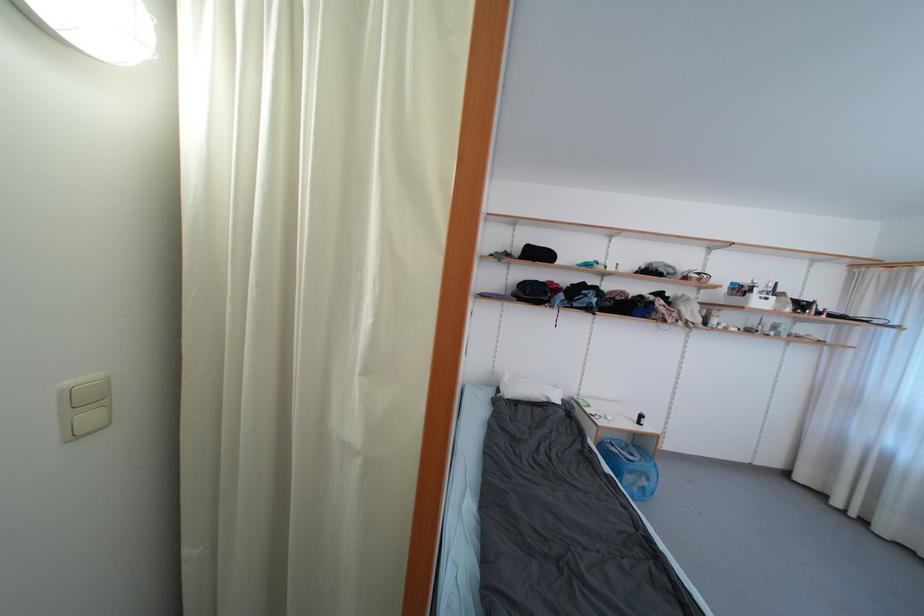
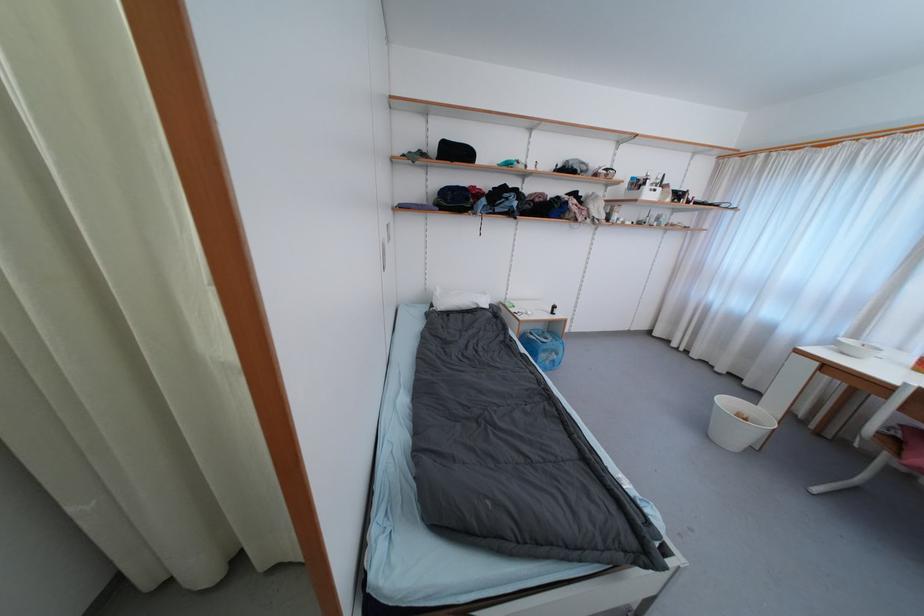
Question: The images are taken continuously from a first-person perspective. In which direction are you moving?

Choices:
 (A) Left
 (B) Right
 (C) Forward
 (D) Backward

Answer: (B)